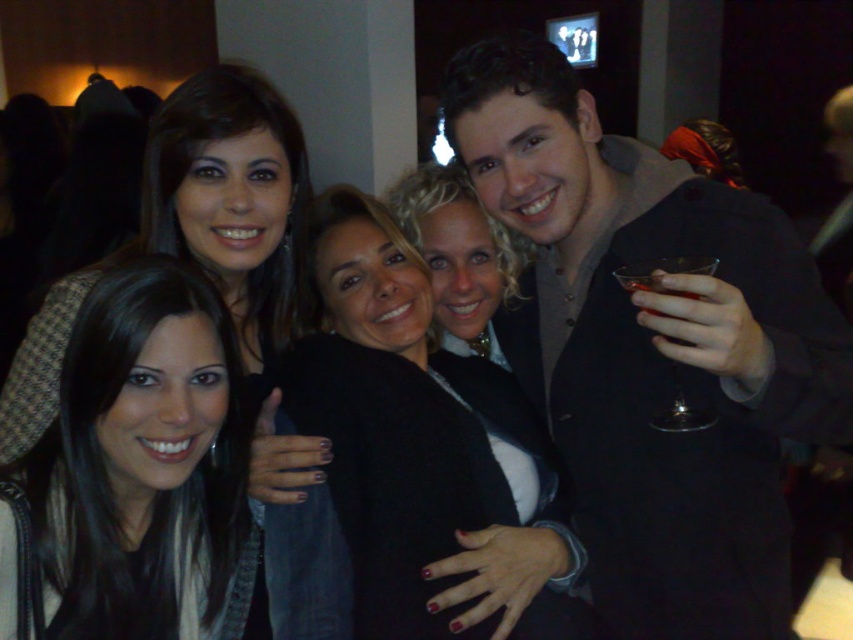
Who is more forward, (219,177) or (654,275)?

Point (654,275) is in front.

Does matte black jacket at upper left have a greater width compared to translucent glass at upper right?

Indeed, matte black jacket at upper left has a greater width compared to translucent glass at upper right.

Image resolution: width=853 pixels, height=640 pixels. What are the coordinates of `matte black jacket at upper left` in the screenshot? It's located at (230, 198).

Which is behind, point (810, 282) or point (697, 259)?

The point (810, 282) is more distant.

Is matte black suit at center to the left of transparent glass at right from the viewer's perspective?

Correct, you'll find matte black suit at center to the left of transparent glass at right.

You are a GUI agent. You are given a task and a screenshot of the screen. Output one action in this format:
    pyautogui.click(x=<x>, y=<y>)
    Task: Click on the matte black suit at center
    Image resolution: width=853 pixels, height=640 pixels.
    Given the screenshot: What is the action you would take?
    pyautogui.click(x=653, y=348)

Does matte black suit at center have a greater height compared to translucent glass at upper right?

Correct, matte black suit at center is much taller as translucent glass at upper right.

Which is in front, point (639, 346) or point (666, 291)?

Point (666, 291) is in front.

In order to click on matte black suit at center in this screenshot , I will do `click(653, 348)`.